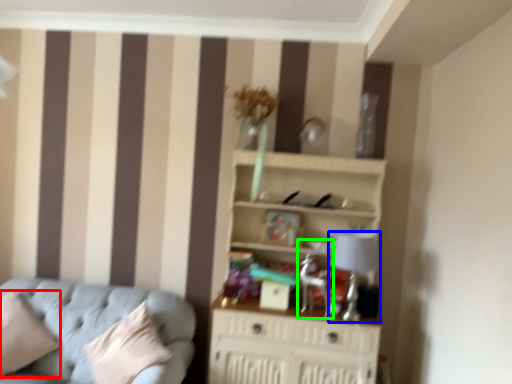
Question: Estimate the real-world distances between objects in this image. Which object is farther from pillow (highlighted by a red box), table lamp (highlighted by a blue box) or swivel chair (highlighted by a green box)?

Choices:
 (A) table lamp
 (B) swivel chair

Answer: (A)